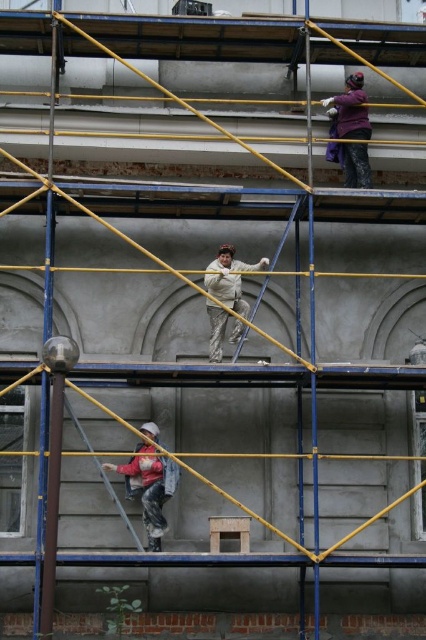
Is denim jacket at lower center shorter than metallic silver ladder at lower center?

No, denim jacket at lower center is not shorter than metallic silver ladder at lower center.

Is point (158, 484) in front of point (123, 509)?

No, (158, 484) is behind (123, 509).

Does point (137, 492) come farther from viewer compared to point (138, 544)?

Yes, it is behind point (138, 544).

Locate an element on the screen. denim jacket at lower center is located at coordinates (149, 486).

Is point (348, 81) behind point (285, 236)?

Yes.

Is purple matte shirt at upper center to the left of white matte ladder at center from the viewer's perspective?

In fact, purple matte shirt at upper center is to the right of white matte ladder at center.

Find the location of a particular element. This screenshot has height=640, width=426. purple matte shirt at upper center is located at coordinates coord(351,109).

Find the location of a particular element. purple matte shirt at upper center is located at coordinates [351, 109].

Is white matte jumpsuit at center to the right of metallic silver ladder at lower center from the viewer's perspective?

Correct, you'll find white matte jumpsuit at center to the right of metallic silver ladder at lower center.

Which is more to the right, white matte jumpsuit at center or metallic silver ladder at lower center?

white matte jumpsuit at center

Is point (221, 301) in front of point (74, 426)?

No, (221, 301) is behind (74, 426).

Where is `white matte jumpsuit at center`? Image resolution: width=426 pixels, height=640 pixels. white matte jumpsuit at center is located at coordinates (230, 278).